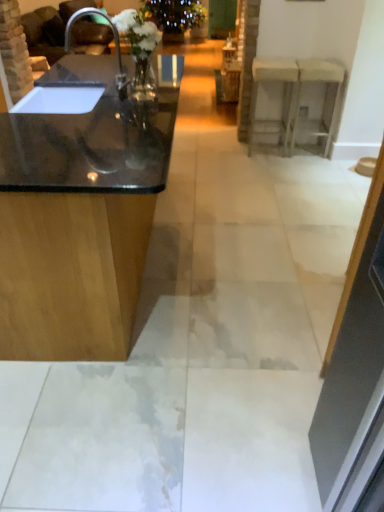
Question: Would you say white glossy counter at upper right, which is the 2th counter from left to right, is to the left or to the right of black glossy countertop at left, the second counter in the right-to-left sequence, in the picture?

Choices:
 (A) right
 (B) left

Answer: (A)

Question: In the image, is white glossy counter at upper right, which is the 2th counter from left to right, positioned in front of or behind black glossy countertop at left, the second counter in the right-to-left sequence?

Choices:
 (A) front
 (B) behind

Answer: (B)

Question: Estimate the real-world distances between objects in this image. Which object is farther from the black glossy countertop at left, arranged as the 1th counter when viewed from the left?

Choices:
 (A) transparent glass door at upper center
 (B) matte black sink at left
 (C) white glossy counter at upper right, the 2th counter when ordered from front to back

Answer: (A)

Question: Which object is the farthest from the matte black sink at left?

Choices:
 (A) white glossy counter at upper right, the 2th counter when ordered from front to back
 (B) black glossy countertop at left, arranged as the 1th counter when viewed from the left
 (C) transparent glass door at upper center

Answer: (C)